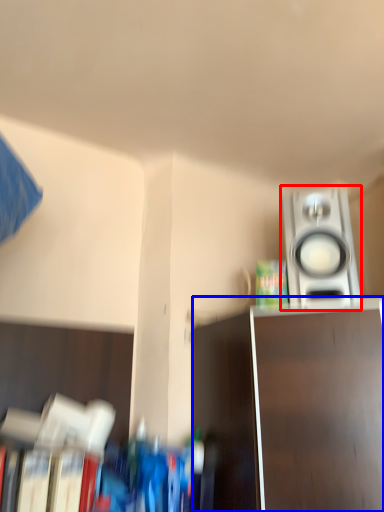
Question: Which of the following is the farthest to the observer, home appliance (highlighted by a red box) or furniture (highlighted by a blue box)?

Choices:
 (A) home appliance
 (B) furniture

Answer: (A)